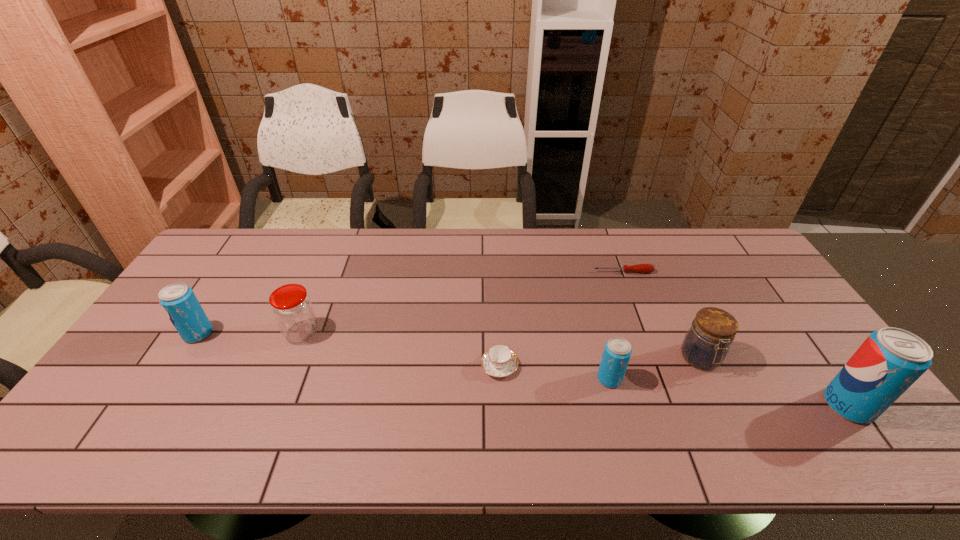
Locate an element on the screen. This screenshot has width=960, height=540. free space between the right jar and the second soda can from right to left is located at coordinates (655, 369).

The width and height of the screenshot is (960, 540). I want to click on vacant area that lies between the rightmost object and the right jar, so point(775,382).

This screenshot has width=960, height=540. Identify the location of vacant area that lies between the sixth object from right to left and the farthest object. (463, 302).

Where is `vacant area that lies between the shortest soda can and the sixth tallest object`? This screenshot has width=960, height=540. vacant area that lies between the shortest soda can and the sixth tallest object is located at coordinates (554, 373).

Identify the location of vacant region between the fifth object from right to left and the second tallest soda can. This screenshot has height=540, width=960. tap(348, 350).

What are the coordinates of `blank region between the fifth object from right to left and the farthest object` in the screenshot? It's located at 562,319.

This screenshot has height=540, width=960. I want to click on free point between the third object from left to right and the second object from left to right, so click(x=400, y=349).

Find the location of a particular element. Image resolution: width=960 pixels, height=540 pixels. empty space between the right jar and the leftmost soda can is located at coordinates (449, 346).

Find the location of `object that stands as the second closest to the shortest soda can`. object that stands as the second closest to the shortest soda can is located at coordinates (499, 361).

Image resolution: width=960 pixels, height=540 pixels. I want to click on the sixth closest object to the leftmost object, so click(x=890, y=360).